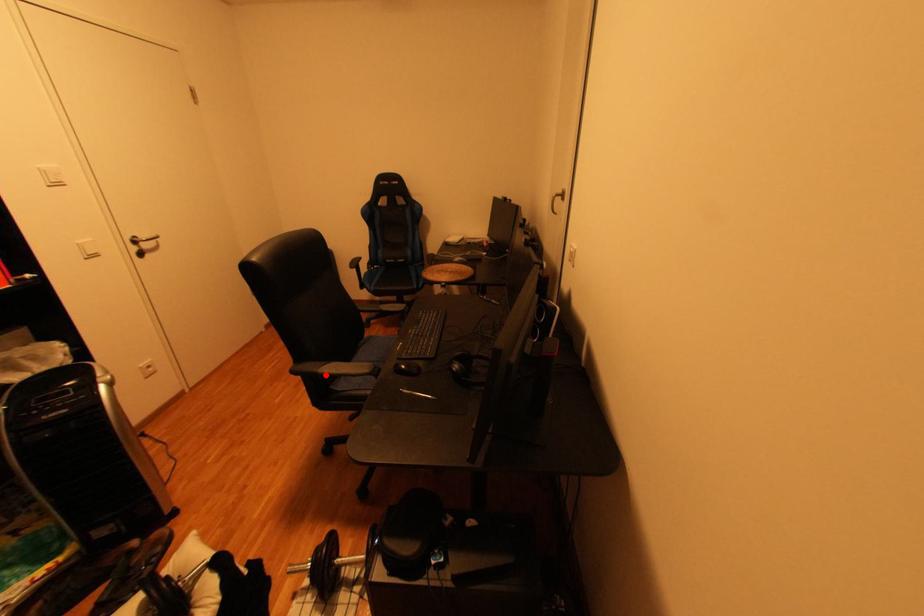
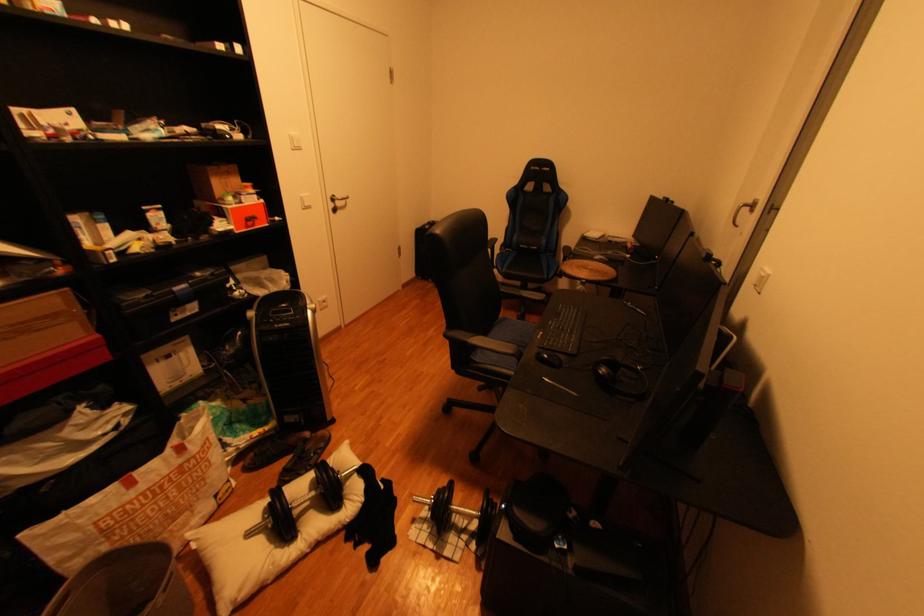
Question: I am providing you with two images of the same scene from different viewpoints. Image1 has a red point marked. In image2, the corresponding 3D location appears at what relative position? Reply with the corresponding letter.

Choices:
 (A) Closer
 (B) Farther

Answer: (B)